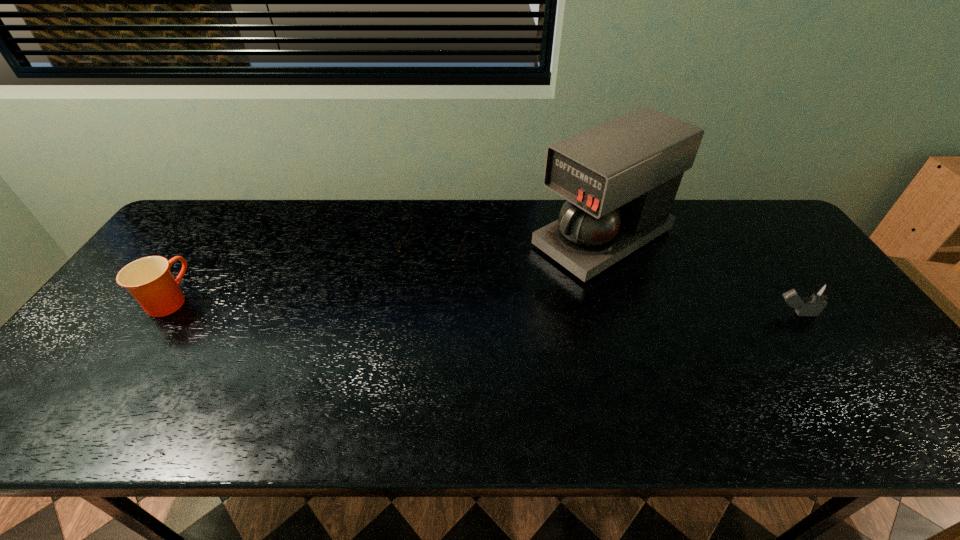
I want to click on free space on the desktop that is between the cup and the rightmost object and is positioned on the carafe side of the second object from right to left, so click(484, 307).

Where is `free space on the desktop that is between the leftmost object and the igniter and is positioned at the hinge ends of the spectacles`? The image size is (960, 540). free space on the desktop that is between the leftmost object and the igniter and is positioned at the hinge ends of the spectacles is located at coordinates (409, 305).